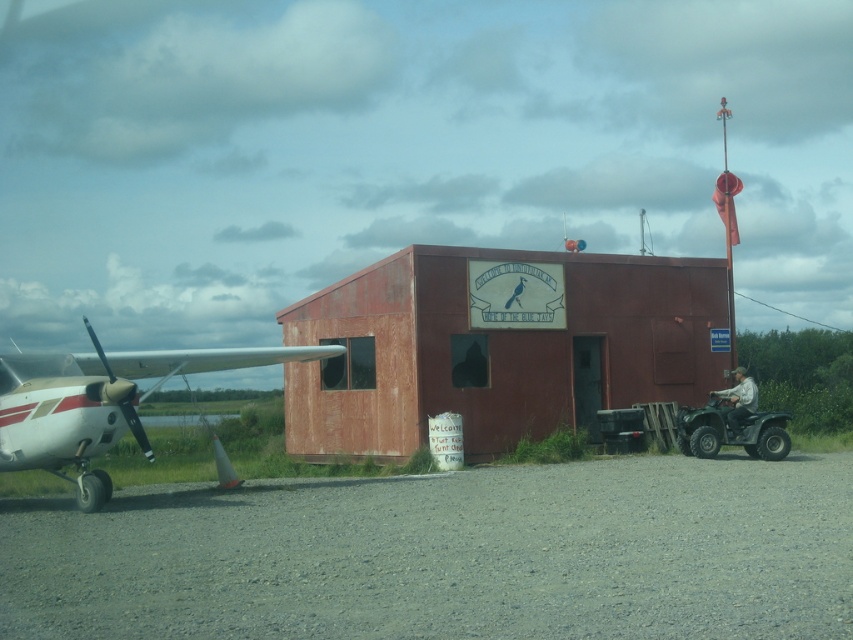
Question: In this image, where is rusty wood hangar at center located relative to white glossy airplane at left?

Choices:
 (A) below
 (B) above

Answer: (B)

Question: Is rusty wood hangar at center positioned before white glossy airplane at left?

Choices:
 (A) no
 (B) yes

Answer: (A)

Question: Which point is farther to the camera?

Choices:
 (A) (251, 364)
 (B) (503, 308)

Answer: (B)

Question: Can you confirm if rusty wood hangar at center is bigger than white glossy airplane at left?

Choices:
 (A) yes
 (B) no

Answer: (B)